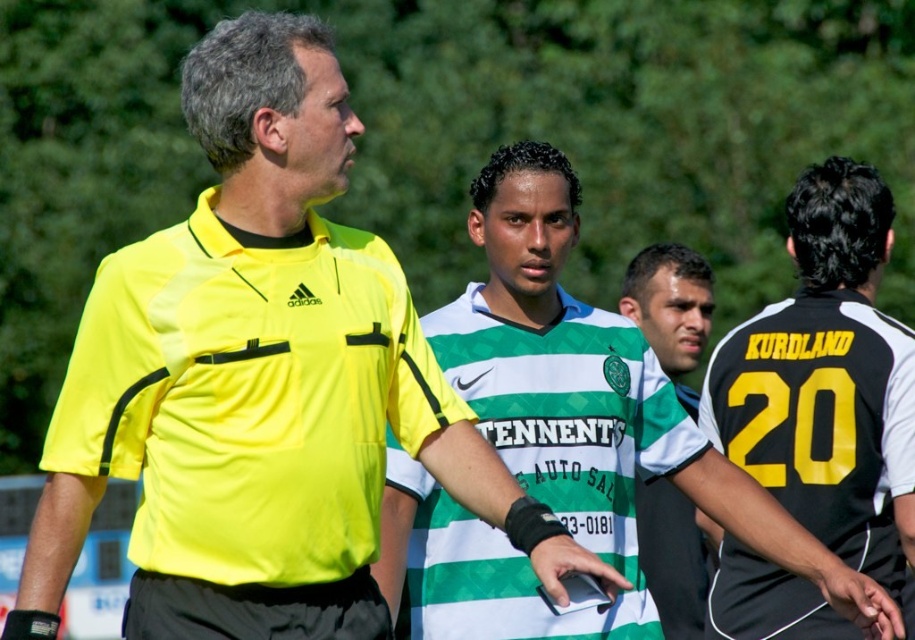
Does black/yellow jersey at center appear on the left side of green and white jersey at center?

No, black/yellow jersey at center is not to the left of green and white jersey at center.

Is black/yellow jersey at center taller than green and white jersey at center?

Indeed, black/yellow jersey at center has a greater height compared to green and white jersey at center.

Who is more forward, (806, 316) or (642, 250)?

Point (806, 316)

The image size is (915, 640). Find the location of `black/yellow jersey at center`. black/yellow jersey at center is located at coordinates (827, 380).

Can you confirm if yellow matte shirt at center is smaller than black/yellow jersey at center?

No.

Locate an element on the screen. Image resolution: width=915 pixels, height=640 pixels. yellow matte shirt at center is located at coordinates 261,384.

Identify the location of yellow matte shirt at center. (261, 384).

Is yellow matte shirt at center closer to camera compared to green striped jersey at center?

Yes, it is.

Is yellow matte shirt at center wider than green striped jersey at center?

Correct, the width of yellow matte shirt at center exceeds that of green striped jersey at center.

Find the location of `yellow matte shirt at center`. yellow matte shirt at center is located at coordinates (261, 384).